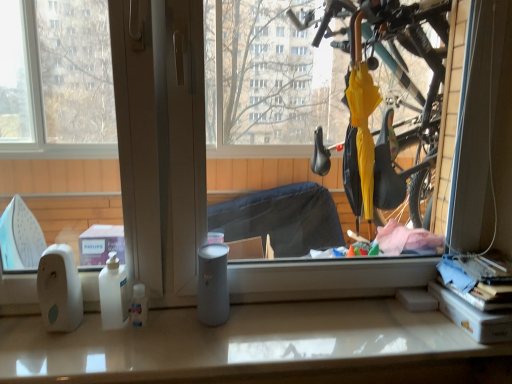
This screenshot has width=512, height=384. Find the location of `free region under transparent plastic umbrella at center (from a real-world perspective)`. free region under transparent plastic umbrella at center (from a real-world perspective) is located at coordinates (283, 320).